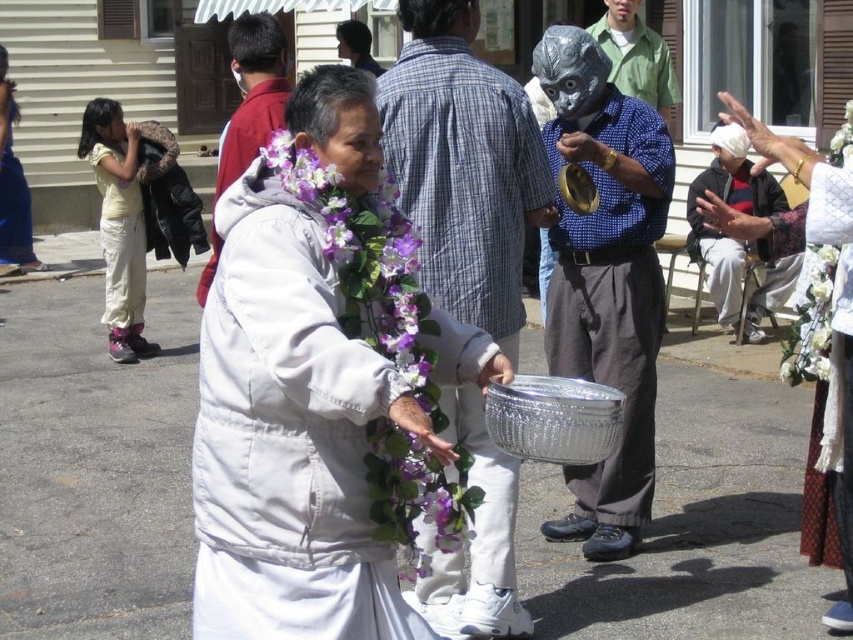
Question: Is metallic silver basket at center to the right of metallic silver mask at upper center from the viewer's perspective?

Choices:
 (A) yes
 (B) no

Answer: (B)

Question: Where is metallic silver mask at upper center located in relation to velvet blue dress at left in the image?

Choices:
 (A) right
 (B) left

Answer: (A)

Question: Considering the real-world distances, which object is farthest from the white lace dress at center?

Choices:
 (A) metallic silver bowl at center
 (B) smooth brown leather jacket at upper center
 (C) white cotton pants at left

Answer: (B)

Question: Is white fabric at center wider than smooth brown leather jacket at upper center?

Choices:
 (A) yes
 (B) no

Answer: (B)

Question: Which point is closer to the camera taking this photo?

Choices:
 (A) (20, 266)
 (B) (265, 40)

Answer: (B)

Question: Which of these objects is positioned farthest from the white fabric shirt at right?

Choices:
 (A) metallic silver basket at center
 (B) velvet blue dress at left
 (C) white fabric at center
 (D) white matte coat at center

Answer: (B)